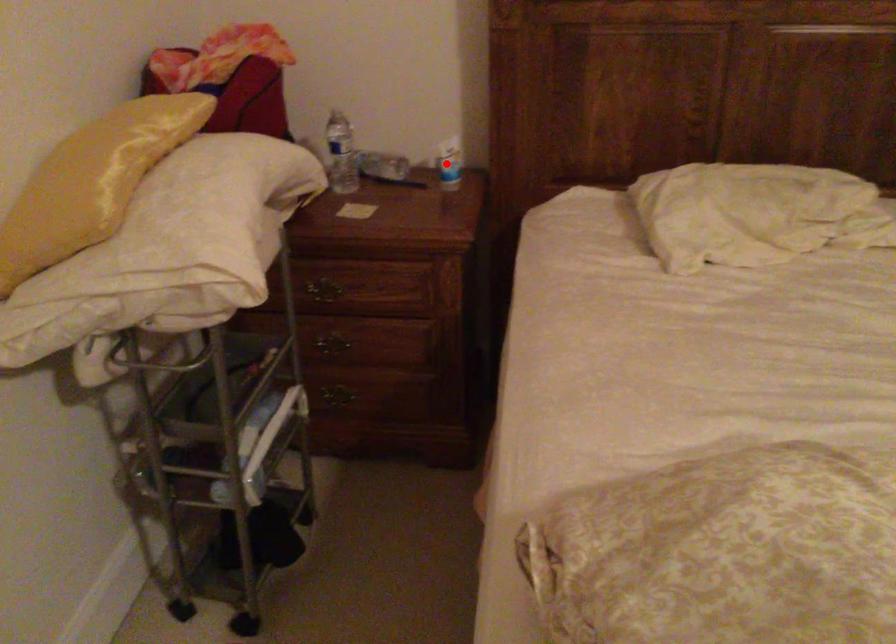
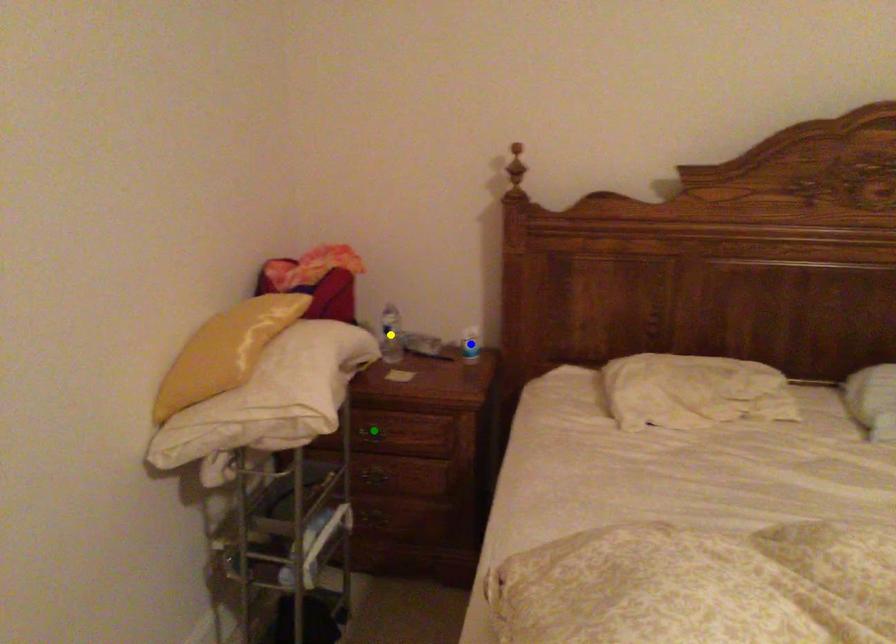
Question: I am providing you with two images of the same scene from different viewpoints. A red point is marked on the first image. You are given multiple points on the second image. Which spot in image 2 lines up with the point in image 1?

Choices:
 (A) green point
 (B) blue point
 (C) yellow point

Answer: (B)